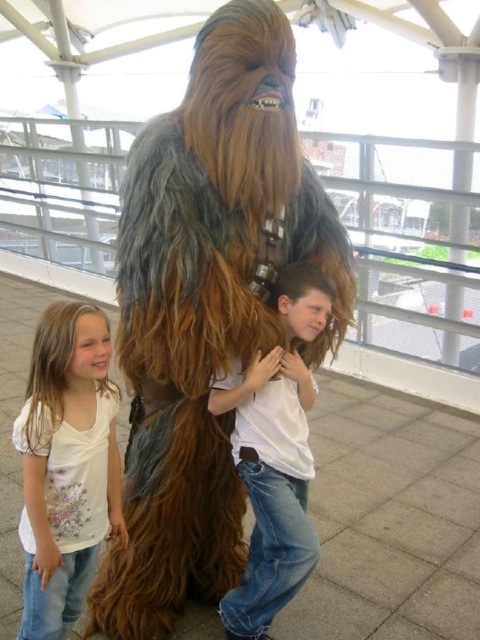
You are a photographer at a family event and need to ensure both the white floral shirt at left and the white cotton shirt at center are visible in the photo. Which shirt should you focus on to ensure the entire shirt is in frame if your camera has limited zoom?

The white floral shirt at left is smaller than the white cotton shirt at center, so focusing on the white cotton shirt at center would ensure it fits within the frame due to its larger size.

You are a photographer trying to capture a closeup shot of the Chewbacca character. You have two points marked on your viewfinder at coordinates point (29, 506) and point (273, 444). Which point should you focus on to ensure the character is in sharp focus?

You should focus on point (29, 506) because it is closer to the viewer than point (273, 444), ensuring the character is in sharp focus.